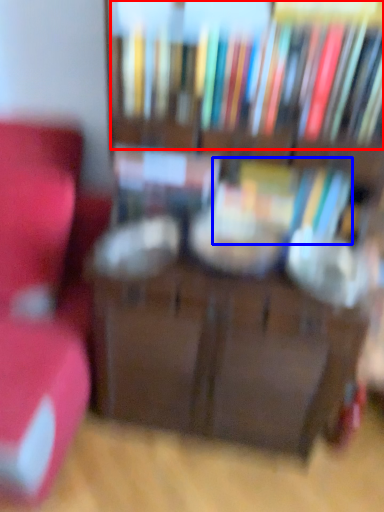
Question: Which point is further to the camera, book (highlighted by a red box) or book (highlighted by a blue box)?

Choices:
 (A) book
 (B) book

Answer: (B)